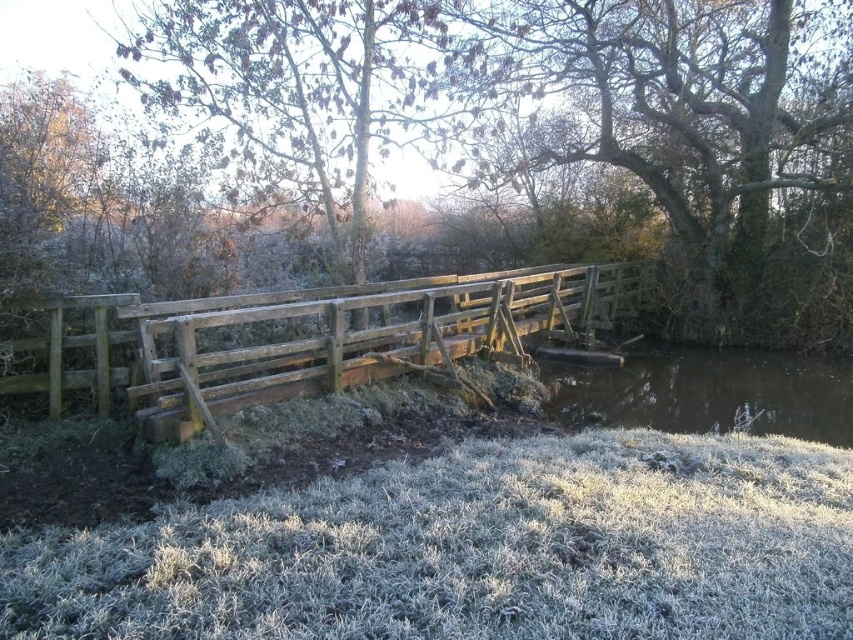
Question: Among these points, which one is farthest from the camera?

Choices:
 (A) (838, 369)
 (B) (503, 1)
 (C) (560, 509)
 (D) (422, 353)

Answer: (B)

Question: Is smooth bark tree at center below brown/rough water at lower center?

Choices:
 (A) no
 (B) yes

Answer: (A)

Question: Which point appears farthest from the camera in this image?

Choices:
 (A) (784, 420)
 (B) (450, 330)
 (C) (519, 616)

Answer: (B)

Question: Does smooth bark tree at center appear on the left side of weathered wood bridge at center?

Choices:
 (A) yes
 (B) no

Answer: (B)

Question: From the image, what is the correct spatial relationship of smooth bark tree at center in relation to brown/rough water at lower center?

Choices:
 (A) left
 (B) right

Answer: (A)

Question: Which object is farther from the camera taking this photo?

Choices:
 (A) frosted grass at lower center
 (B) smooth bark tree at center
 (C) weathered wood bridge at center
 (D) brown/rough water at lower center

Answer: (B)